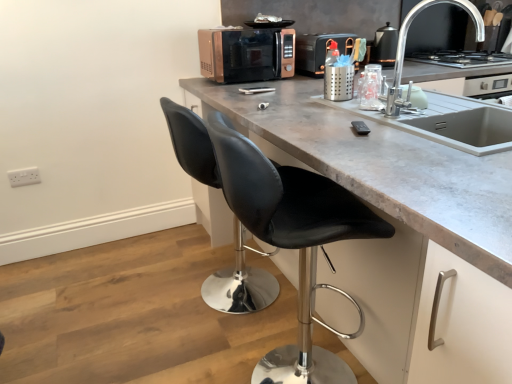
Question: From a real-world perspective, is rose gold metallic microwave at center physically below concrete gray countertop at center?

Choices:
 (A) yes
 (B) no

Answer: (B)

Question: Considering the relative sizes of rose gold metallic microwave at center and concrete gray countertop at center in the image provided, is rose gold metallic microwave at center thinner than concrete gray countertop at center?

Choices:
 (A) yes
 (B) no

Answer: (A)

Question: From a real-world perspective, is rose gold metallic microwave at center positioned over concrete gray countertop at center based on gravity?

Choices:
 (A) yes
 (B) no

Answer: (A)

Question: Can you confirm if rose gold metallic microwave at center is wider than concrete gray countertop at center?

Choices:
 (A) yes
 (B) no

Answer: (B)

Question: Are rose gold metallic microwave at center and concrete gray countertop at center beside each other?

Choices:
 (A) yes
 (B) no

Answer: (B)

Question: Is point (384, 52) closer or farther from the camera than point (240, 77)?

Choices:
 (A) farther
 (B) closer

Answer: (A)

Question: Considering the positions of metallic silver kettle at upper right, which is the 1th appliance in right-to-left order, and rose gold metallic microwave at center in the image, is metallic silver kettle at upper right, which is the 1th appliance in right-to-left order, bigger or smaller than rose gold metallic microwave at center?

Choices:
 (A) big
 (B) small

Answer: (B)

Question: From a real-world perspective, relative to rose gold metallic microwave at center, is metallic silver kettle at upper right, the second appliance from the left, vertically above or below?

Choices:
 (A) above
 (B) below

Answer: (B)

Question: Considering their positions, is metallic silver kettle at upper right, the second appliance from the left, located in front of or behind rose gold metallic microwave at center?

Choices:
 (A) front
 (B) behind

Answer: (B)

Question: Considering the positions of black leather stool at center and rose gold metallic toaster at upper center, the 1th appliance viewed from the left, in the image, is black leather stool at center wider or thinner than rose gold metallic toaster at upper center, the 1th appliance viewed from the left,?

Choices:
 (A) thin
 (B) wide

Answer: (B)

Question: Considering their positions, is black leather stool at center located in front of or behind rose gold metallic toaster at upper center, the 1th appliance viewed from the left?

Choices:
 (A) front
 (B) behind

Answer: (A)

Question: Is black leather stool at center bigger or smaller than rose gold metallic toaster at upper center, the second appliance in the right-to-left sequence?

Choices:
 (A) small
 (B) big

Answer: (B)

Question: Based on their positions, is black leather stool at center located to the left or right of rose gold metallic toaster at upper center, the 1th appliance viewed from the left?

Choices:
 (A) left
 (B) right

Answer: (A)

Question: Is rose gold metallic microwave at center in front of or behind concrete gray countertop at center in the image?

Choices:
 (A) front
 (B) behind

Answer: (B)

Question: Considering the positions of rose gold metallic microwave at center and concrete gray countertop at center in the image, is rose gold metallic microwave at center taller or shorter than concrete gray countertop at center?

Choices:
 (A) tall
 (B) short

Answer: (B)